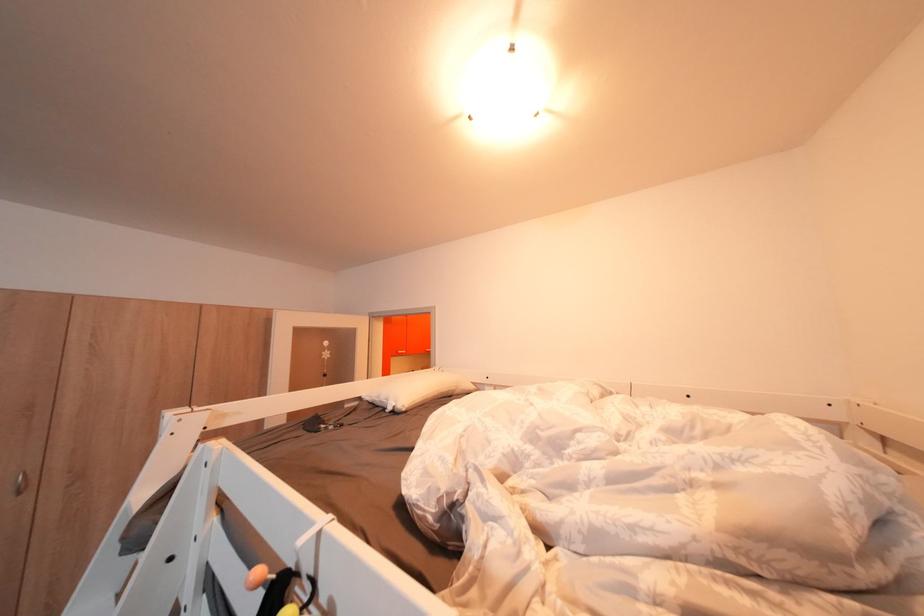
Where is `silver cabinet handle`? This screenshot has height=616, width=924. silver cabinet handle is located at coordinates (19, 483).